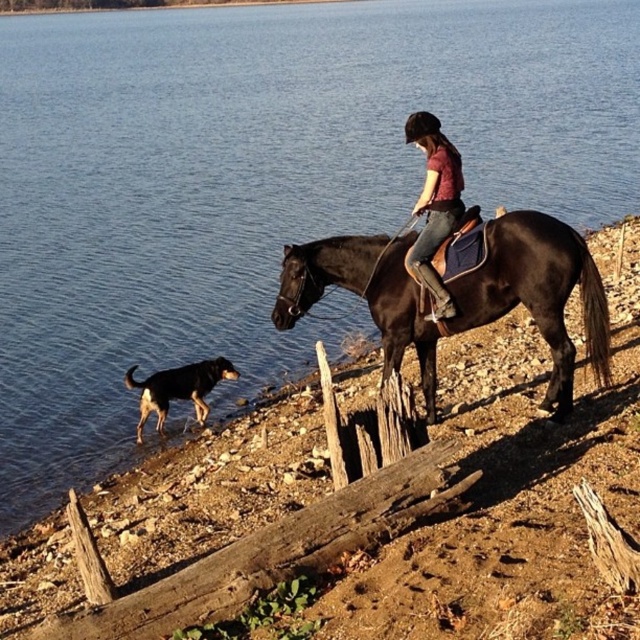
You are a photographer trying to capture the rider and horse in the scene. If you want to ensure both the shiny dark brown horse at upper center and the denim jeans at center are fully visible in the frame, which object should you focus on to avoid cropping either?

You should focus on the shiny dark brown horse at upper center because its width is larger than the denim jeans at center, so ensuring the horse fits will automatically accommodate the smaller jeans within the frame.

You are a photographer positioned at the center of the lakeside scene. You want to capture a shot of the shiny dark brown horse at upper center. Which direction should you move to get closer to the horse?

The shiny dark brown horse at upper center is located at point [461,294], so you should move towards the upper center direction to get closer to the horse.

You are standing at the lakeside and want to take a photo of the two points marked in the scene. Which point, point (483, 284) or point (157, 384), appears larger in your camera view?

Point (483, 284) appears larger in the camera view because it is closer to the camera than point (157, 384).